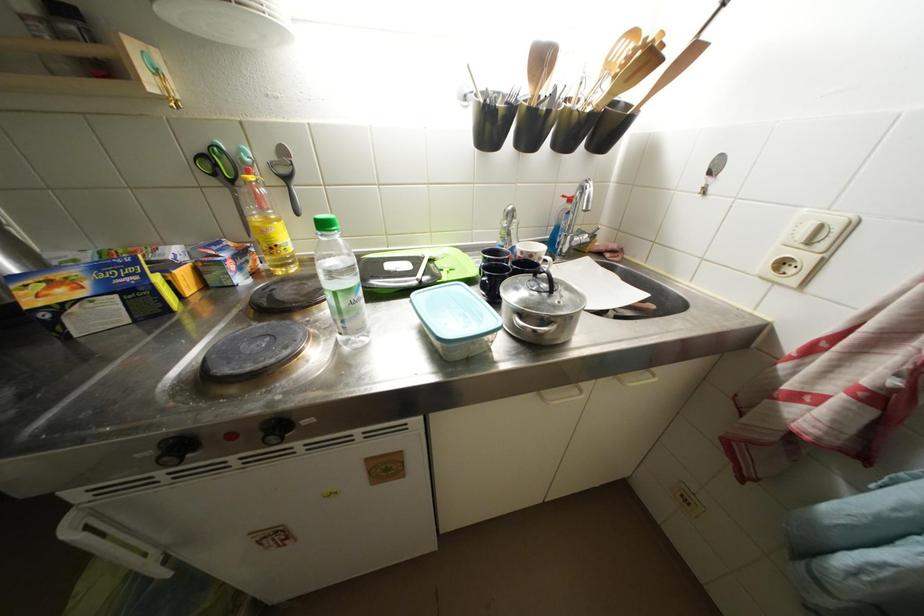
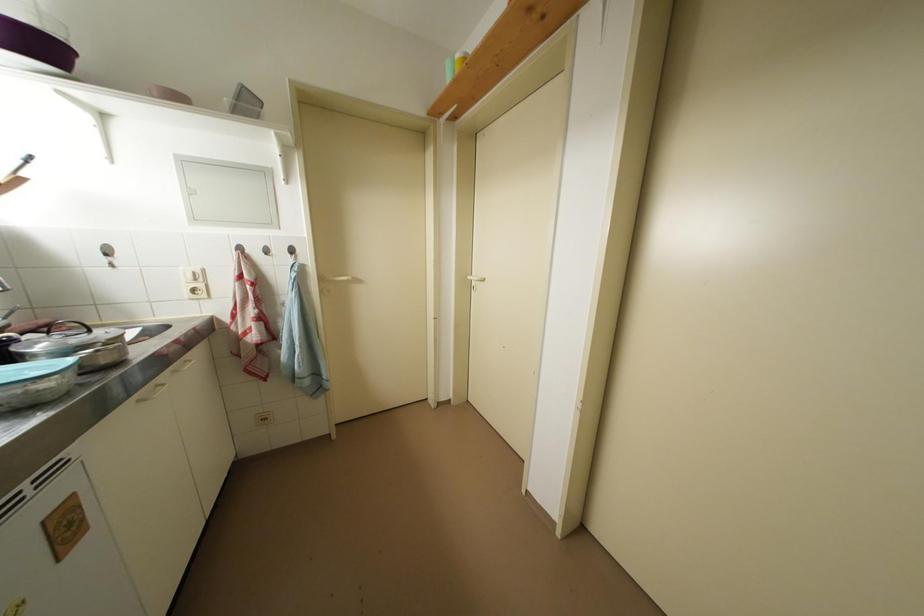
The first image is from the beginning of the video and the second image is from the end. How did the camera likely rotate when shooting the video?

The rotation direction of the camera is right-down.